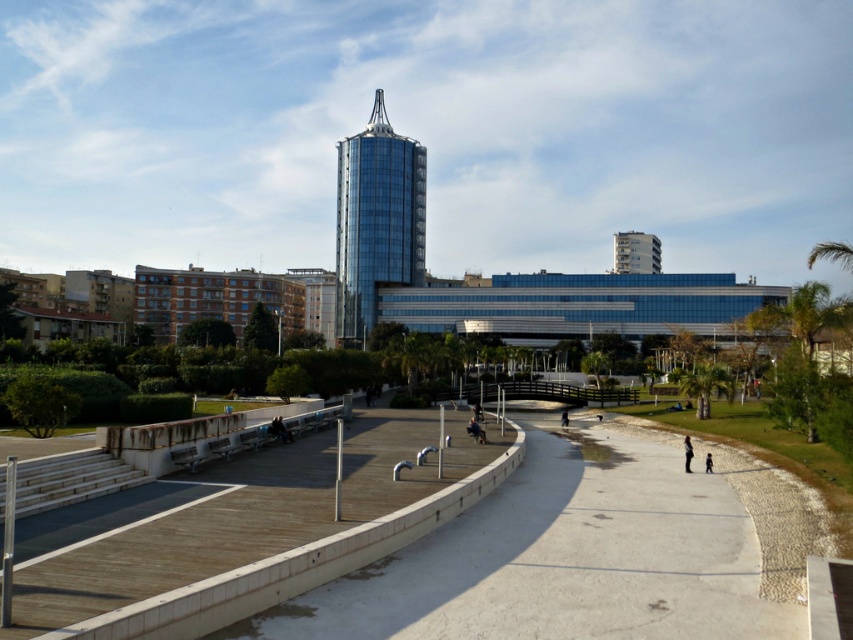
From the picture: You are standing at the entrance of the urban area and see the smooth concrete path at center and the dark blue jeans at center. Which object is higher in elevation?

The smooth concrete path at center is much taller than the dark blue jeans at center, so the smooth concrete path at center is higher in elevation.

You are standing at the point marked as point (636,252) in the image. What is the nearest object to you in the scene?

The nearest object to you is the white concrete building at upper right because the point (636,252) is located on it.